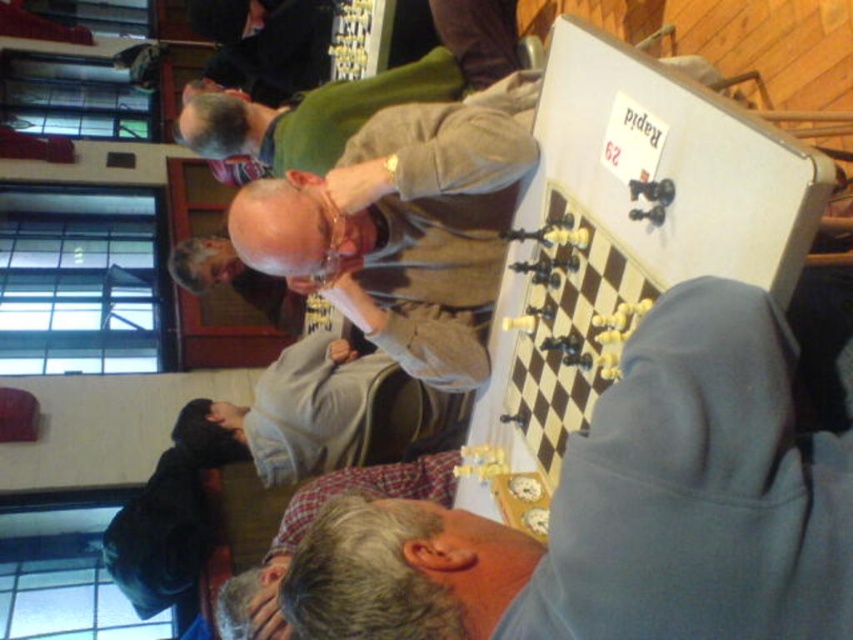
Is gray hoodie at center positioned in front of gray sweatshirt at lower left?

Yes, it is in front of gray sweatshirt at lower left.

Who is more distant from viewer, (596, 442) or (218, 413)?

The point (218, 413) is behind.

Where is `gray hoodie at center`? The image size is (853, 640). gray hoodie at center is located at coordinates (624, 512).

Looking at this image, can you confirm if gray sweatshirt at lower left is positioned to the right of gray plaid shirt at lower center?

Incorrect, gray sweatshirt at lower left is not on the right side of gray plaid shirt at lower center.

Between point (210, 406) and point (279, 541), which one is positioned behind?

Positioned behind is point (210, 406).

Image resolution: width=853 pixels, height=640 pixels. I want to click on gray sweatshirt at lower left, so click(x=320, y=413).

Is light brown fabric shirt at center taller than gray sweatshirt at lower left?

Correct, light brown fabric shirt at center is much taller as gray sweatshirt at lower left.

Is light brown fabric shirt at center shorter than gray sweatshirt at lower left?

Incorrect, light brown fabric shirt at center's height does not fall short of gray sweatshirt at lower left's.

Does point (511, 90) come farther from viewer compared to point (344, 404)?

No, (511, 90) is in front of (344, 404).

You are a GUI agent. You are given a task and a screenshot of the screen. Output one action in this format:
    pyautogui.click(x=<x>, y=<y>)
    Task: Click on the light brown fabric shirt at center
    The image size is (853, 640).
    Given the screenshot: What is the action you would take?
    (x=404, y=225)